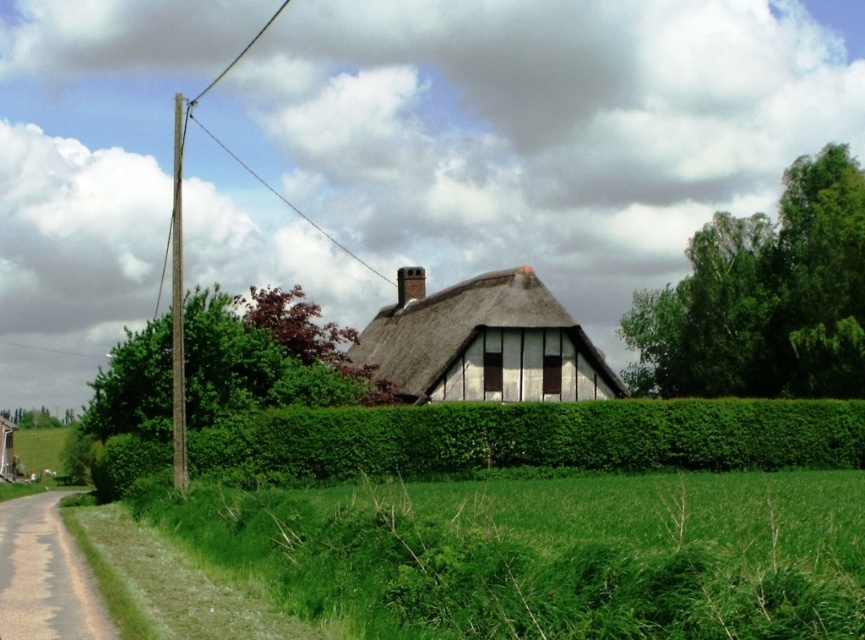
You are standing at the center of the image. Which direction should you walk to reach the green grass at lower left?

You should walk towards the lower left direction to reach the green grass at lower left.

You are standing in the rural scene and want to walk from the thatched roof at center to the green grass at lower left. In which direction should you head?

The green grass at lower left is to the right of the thatched roof at center, so you should head to the right to reach the green grass at lower left from the thatched roof at center.